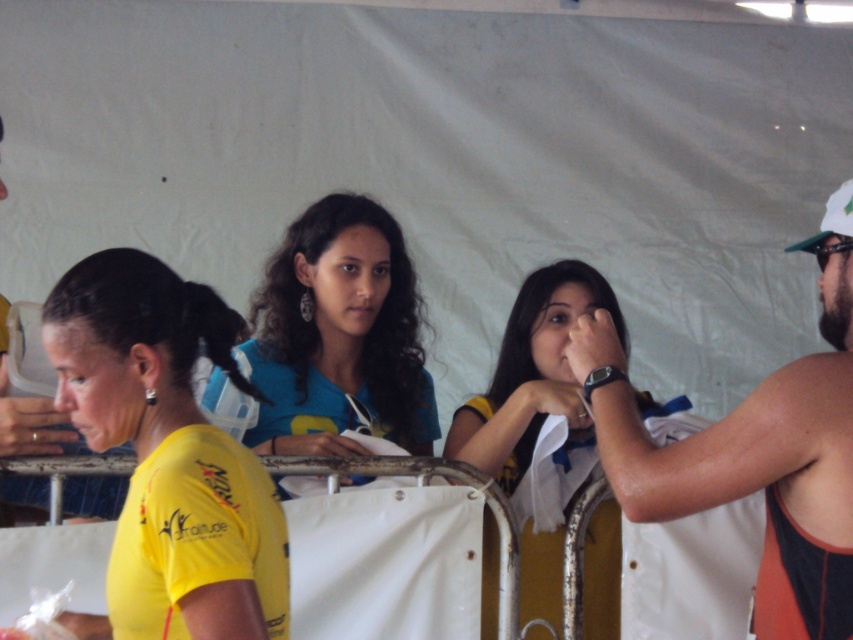
Can you confirm if blue matte shirt at center is positioned to the right of matte yellow shirt at left?

Yes, blue matte shirt at center is to the right of matte yellow shirt at left.

Can you confirm if blue matte shirt at center is taller than matte yellow shirt at left?

Correct, blue matte shirt at center is much taller as matte yellow shirt at left.

Identify the location of blue matte shirt at center. Image resolution: width=853 pixels, height=640 pixels. (338, 337).

Find the location of `blue matte shirt at center`. blue matte shirt at center is located at coordinates (338, 337).

Between yellow matte shirt at left and blue matte shirt at center, which one is positioned higher?

Positioned higher is blue matte shirt at center.

Can you confirm if yellow matte shirt at left is positioned above blue matte shirt at center?

No, yellow matte shirt at left is not above blue matte shirt at center.

Is point (132, 310) positioned before point (306, 387)?

Yes, point (132, 310) is closer to viewer.

I want to click on yellow matte shirt at left, so click(167, 451).

Does point (131, 253) lie behind point (821, 595)?

Yes, it is behind point (821, 595).

Who is more forward, (154,376) or (585,346)?

Point (154,376) is in front.

Is point (200, 557) positioned behind point (643, 435)?

No, it is not.

Identify the location of yellow matte shirt at left. (167, 451).